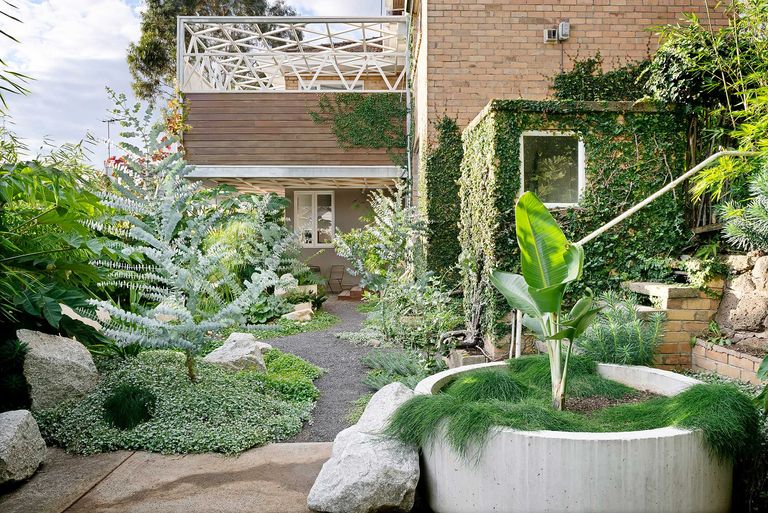
I want to click on planter, so click(x=601, y=472).